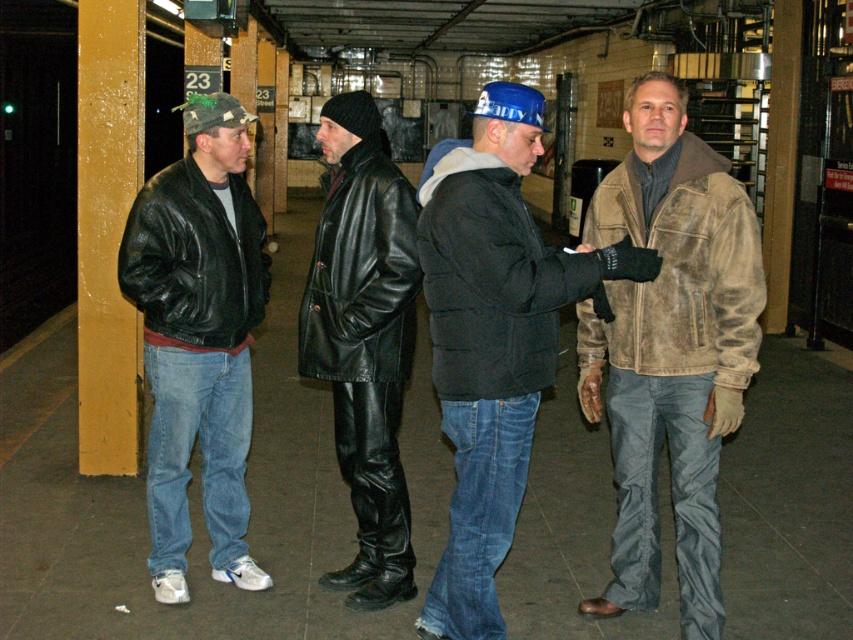
You are waiting for the subway and want to know which man wearing a black leather jacket is closer to you. There are two men with black leather jackets in the scene. One is wearing a matte black leather jacket at left and the other is wearing a black leather jacket at center. Which one is closer to you?

The matte black leather jacket at left is closer to you because it is positioned further to the viewer than the black leather jacket at center.